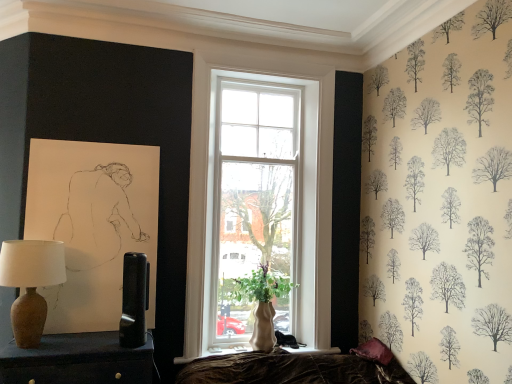
Question: Is green matte vase at window positioned beyond the bounds of matte brown lamp at left?

Choices:
 (A) no
 (B) yes

Answer: (B)

Question: Is green matte vase at window oriented towards matte brown lamp at left?

Choices:
 (A) yes
 (B) no

Answer: (B)

Question: Considering the relative sizes of green matte vase at window and matte brown lamp at left in the image provided, is green matte vase at window thinner than matte brown lamp at left?

Choices:
 (A) no
 (B) yes

Answer: (B)

Question: Is green matte vase at window closer to the viewer compared to matte brown lamp at left?

Choices:
 (A) yes
 (B) no

Answer: (B)

Question: Is the surface of green matte vase at window in direct contact with matte brown lamp at left?

Choices:
 (A) no
 (B) yes

Answer: (A)

Question: Is point (385, 352) closer or farther from the camera than point (132, 253)?

Choices:
 (A) closer
 (B) farther

Answer: (B)

Question: Is velvet purple pillow at lower right wider or thinner than matte black table lamp at center, the second table lamp from the left?

Choices:
 (A) wide
 (B) thin

Answer: (A)

Question: From the image's perspective, is velvet purple pillow at lower right positioned above or below matte black table lamp at center, the second table lamp from the left?

Choices:
 (A) above
 (B) below

Answer: (B)

Question: Choose the correct answer: Is velvet purple pillow at lower right inside matte black table lamp at center, the second table lamp from the left, or outside it?

Choices:
 (A) inside
 (B) outside

Answer: (B)

Question: Considering the positions of green matte vase at window and matte black table lamp at center, the second table lamp from the left, in the image, is green matte vase at window wider or thinner than matte black table lamp at center, the second table lamp from the left,?

Choices:
 (A) wide
 (B) thin

Answer: (A)

Question: Is green matte vase at window inside or outside of matte black table lamp at center, which is counted as the first table lamp, starting from the right?

Choices:
 (A) outside
 (B) inside

Answer: (A)

Question: Is point (263, 268) positioned closer to the camera than point (120, 326)?

Choices:
 (A) farther
 (B) closer

Answer: (A)

Question: Visually, is green matte vase at window positioned to the left or to the right of matte black table lamp at center, the second table lamp from the left?

Choices:
 (A) right
 (B) left

Answer: (A)

Question: Considering the positions of velvet purple pillow at lower right and matte brown lamp at left in the image, is velvet purple pillow at lower right wider or thinner than matte brown lamp at left?

Choices:
 (A) thin
 (B) wide

Answer: (A)

Question: Is velvet purple pillow at lower right to the left or to the right of matte brown lamp at left in the image?

Choices:
 (A) left
 (B) right

Answer: (B)